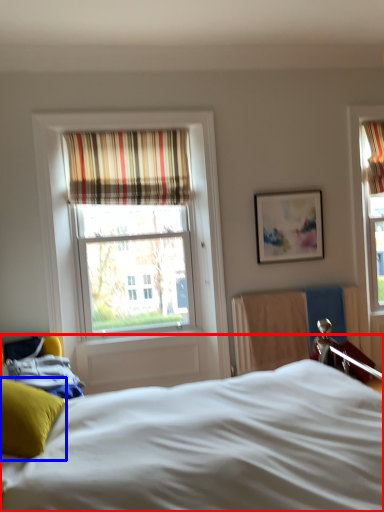
Question: Which object appears closest to the camera in this image, bed (highlighted by a red box) or pillow (highlighted by a blue box)?

Choices:
 (A) bed
 (B) pillow

Answer: (A)